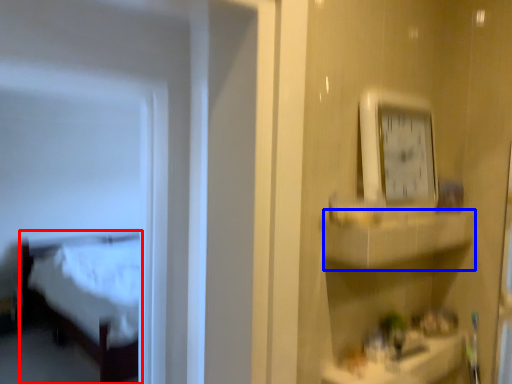
Question: Which object appears farthest to the camera in this image, furniture (highlighted by a red box) or cabinet (highlighted by a blue box)?

Choices:
 (A) furniture
 (B) cabinet

Answer: (A)